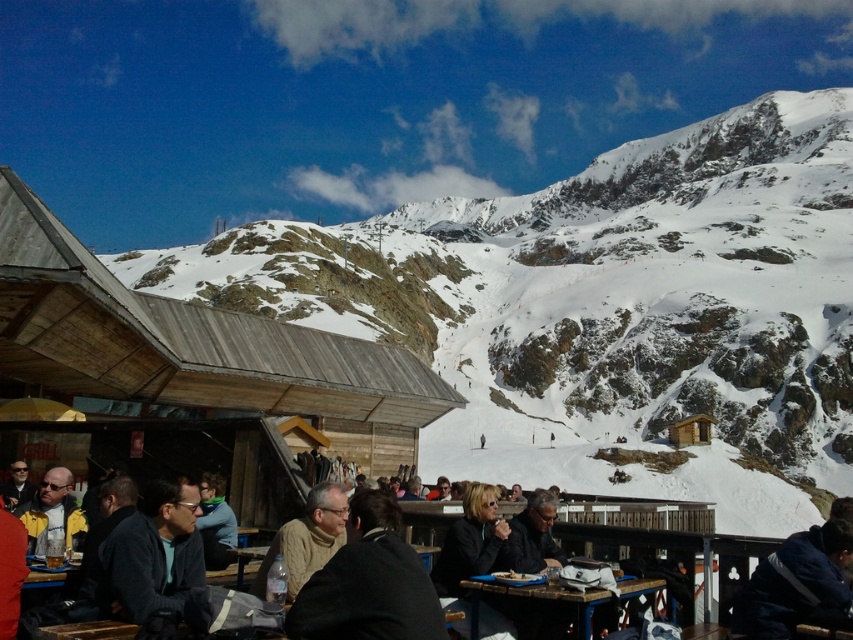
Question: Among these points, which one is nearest to the camera?

Choices:
 (A) pos(273,540)
 (B) pos(347,616)

Answer: (B)

Question: Which point is farther to the camera?

Choices:
 (A) yellow jacket at lower left
 (B) light blue sweater at center
 (C) knitted sweater at center
 (D) dark gray sweater at center

Answer: (D)

Question: Which point is closer to the camera?

Choices:
 (A) (189, 588)
 (B) (532, 595)

Answer: (A)

Question: Considering the relative positions of wooden hut at center and dark gray sweater at center in the image provided, where is wooden hut at center located with respect to dark gray sweater at center?

Choices:
 (A) above
 (B) below

Answer: (A)

Question: From the image, what is the correct spatial relationship of dark gray sweater at lower left in relation to yellow jacket at lower left?

Choices:
 (A) below
 (B) above

Answer: (B)

Question: Does wooden hut at center have a greater width compared to knitted sweater at center?

Choices:
 (A) no
 (B) yes

Answer: (B)